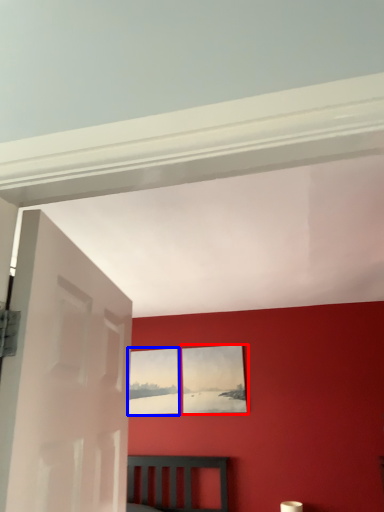
Question: Which of the following is the farthest to the observer, picture frame (highlighted by a red box) or picture frame (highlighted by a blue box)?

Choices:
 (A) picture frame
 (B) picture frame

Answer: (B)